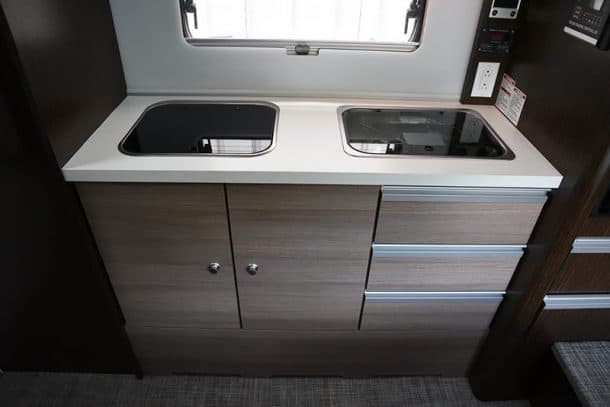
Where is `screen`? screen is located at coordinates (504, 10).